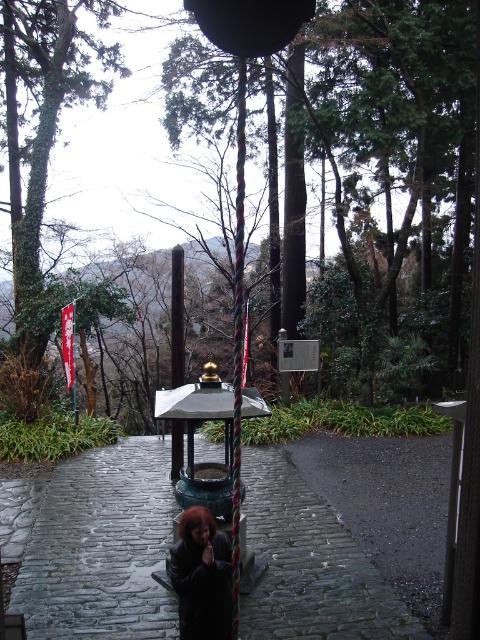
Between dark gray cobblestone path at center and black polished pole at center, which one has more height?

With more height is black polished pole at center.

Can you confirm if dark gray cobblestone path at center is bigger than black polished pole at center?

Actually, dark gray cobblestone path at center might be smaller than black polished pole at center.

Image resolution: width=480 pixels, height=640 pixels. I want to click on dark gray cobblestone path at center, so point(334,560).

Who is taller, matte black coat at center or black polished pole at center?

Standing taller between the two is black polished pole at center.

Consider the image. Is matte black coat at center behind black polished pole at center?

No, it is in front of black polished pole at center.

Does point (207, 536) come in front of point (173, 310)?

Yes, it is.

The height and width of the screenshot is (640, 480). Find the location of `matte black coat at center`. matte black coat at center is located at coordinates (202, 577).

Between green leafy tree at center and dark gray cobblestone path at center, which one appears on the right side from the viewer's perspective?

dark gray cobblestone path at center

Is green leafy tree at center positioned behind dark gray cobblestone path at center?

No, it is not.

Describe the element at coordinates (385, 156) in the screenshot. I see `green leafy tree at center` at that location.

Find the location of a particular element. The width and height of the screenshot is (480, 640). green leafy tree at center is located at coordinates (385, 156).